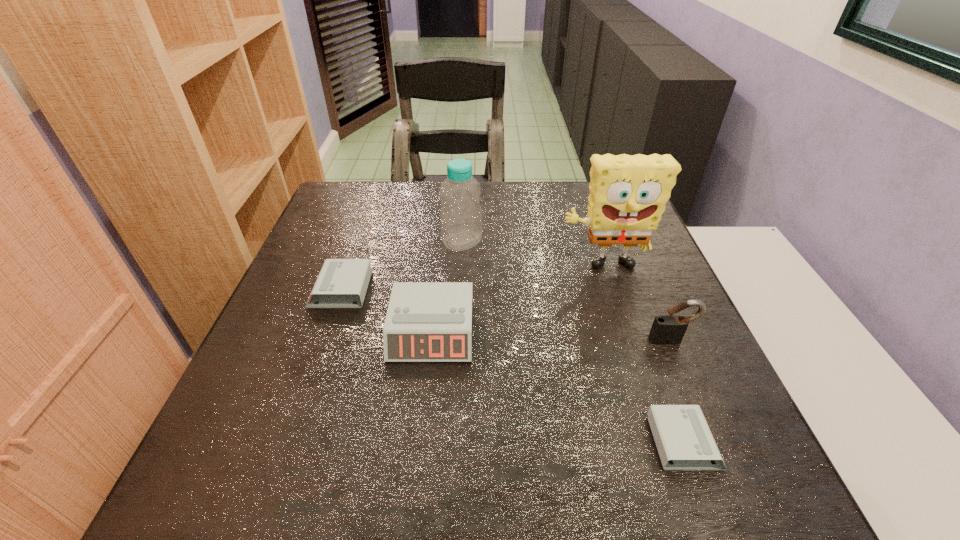
Where is `vacant area located on the front of the fifth tallest object`? The height and width of the screenshot is (540, 960). vacant area located on the front of the fifth tallest object is located at coordinates (302, 399).

This screenshot has width=960, height=540. In order to click on vacant area situated on the back of the second alarm clock from right to left in this screenshot , I will do `click(444, 221)`.

This screenshot has width=960, height=540. I want to click on free space located on the left of the rightmost alarm clock, so click(x=456, y=442).

The height and width of the screenshot is (540, 960). Identify the location of free spot located 0.200m on the face of the sponge. (629, 348).

Locate an element on the screen. vacant area located 0.240m on the left of the bottle is located at coordinates (349, 242).

Locate an element on the screen. Image resolution: width=960 pixels, height=540 pixels. free space located with the keyhole on the front of the fourth shortest object is located at coordinates (714, 442).

You are a GUI agent. You are given a task and a screenshot of the screen. Output one action in this format:
    pyautogui.click(x=<x>, y=<y>)
    Task: Click on the object present at the near edge
    
    Given the screenshot: What is the action you would take?
    pyautogui.click(x=681, y=433)

Locate an element on the screen. object that is at the left edge is located at coordinates (341, 282).

Where is `alarm clock positioned at the right edge`? alarm clock positioned at the right edge is located at coordinates pos(681,433).

Locate an element on the screen. This screenshot has width=960, height=540. sponge that is positioned at the right edge is located at coordinates (628, 194).